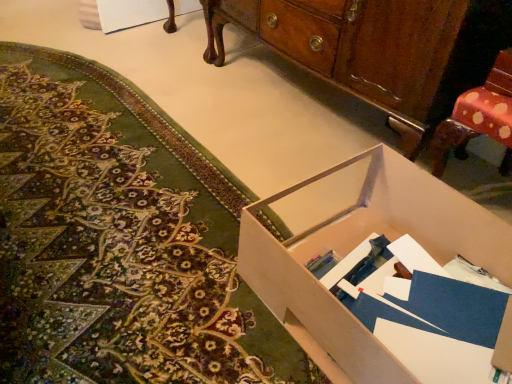
Question: Is matte cardboard box at lower right in front of or behind white cardboard box at center in the image?

Choices:
 (A) behind
 (B) front

Answer: (A)

Question: Considering the positions of matte cardboard box at lower right and white cardboard box at center in the image, is matte cardboard box at lower right bigger or smaller than white cardboard box at center?

Choices:
 (A) small
 (B) big

Answer: (B)

Question: Estimate the real-world distances between objects in this image. Which object is closer to the wooden cabinet at center?

Choices:
 (A) matte cardboard box at lower right
 (B) white cardboard box at center

Answer: (B)

Question: Considering the real-world distances, which object is farthest from the white cardboard box at center?

Choices:
 (A) matte cardboard box at lower right
 (B) wooden cabinet at center

Answer: (B)